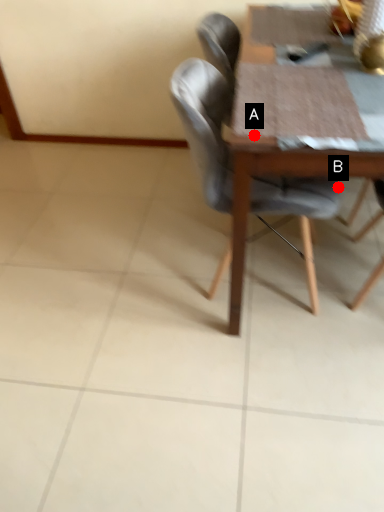
Question: Two points are circled on the image, labeled by A and B beside each circle. Which point is farther to the camera?

Choices:
 (A) A is further
 (B) B is further

Answer: (B)